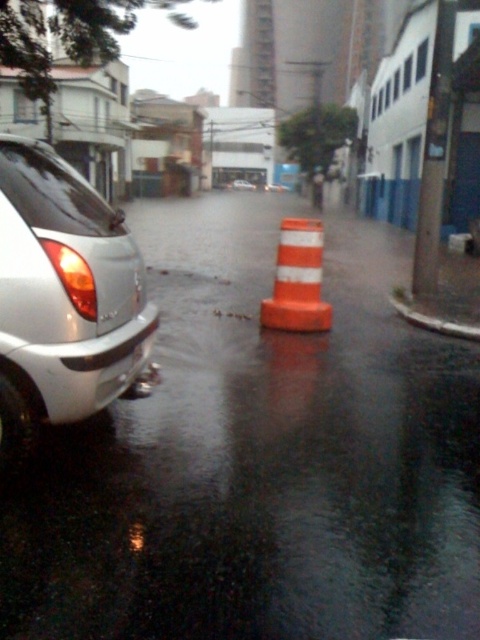
Who is higher up, glossy orange cone at center or matte black car at center?

matte black car at center is above.

Is point (283, 541) farther from viewer compared to point (247, 180)?

That is False.

The width and height of the screenshot is (480, 640). Find the location of `glossy orange cone at center`. glossy orange cone at center is located at coordinates (260, 458).

Is point (94, 380) positioned behind point (250, 188)?

That is False.

Between satin silver car at left and matte black car at center, which one has more height?

Standing taller between the two is satin silver car at left.

Between point (32, 218) and point (251, 188), which one is positioned in front?

Point (32, 218) is in front.

Locate an element on the screen. satin silver car at left is located at coordinates (63, 298).

Between glossy orange cone at center and orange reflective cone at center, which one appears on the left side from the viewer's perspective?

orange reflective cone at center is more to the left.

Which is behind, point (389, 541) or point (276, 276)?

The point (276, 276) is behind.

Does point (192, 419) lie in front of point (289, 296)?

Yes, it is.

Where is `glossy orange cone at center`? This screenshot has height=640, width=480. glossy orange cone at center is located at coordinates (260, 458).